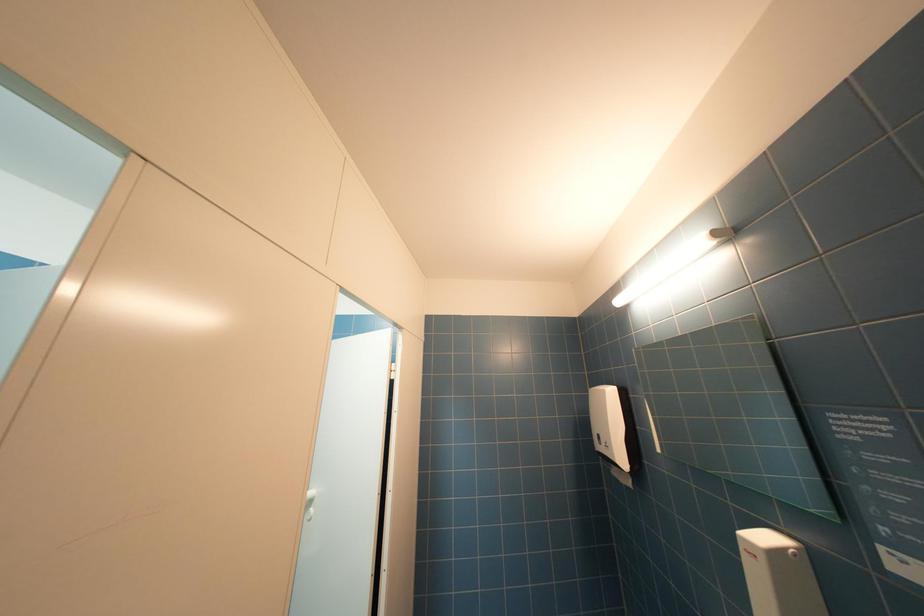
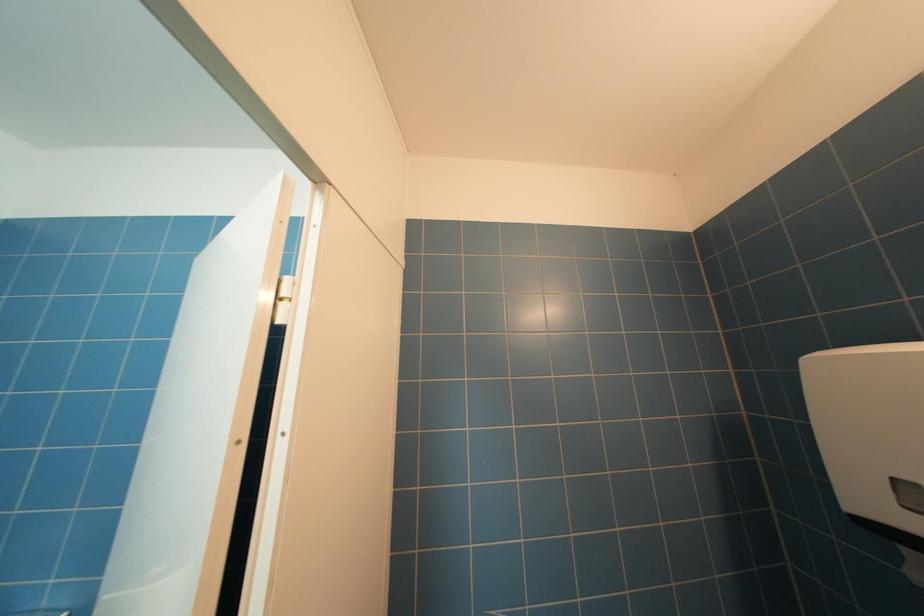
Question: How did the camera likely rotate?

Choices:
 (A) Left
 (B) Right
 (C) Up
 (D) Down

Answer: (D)